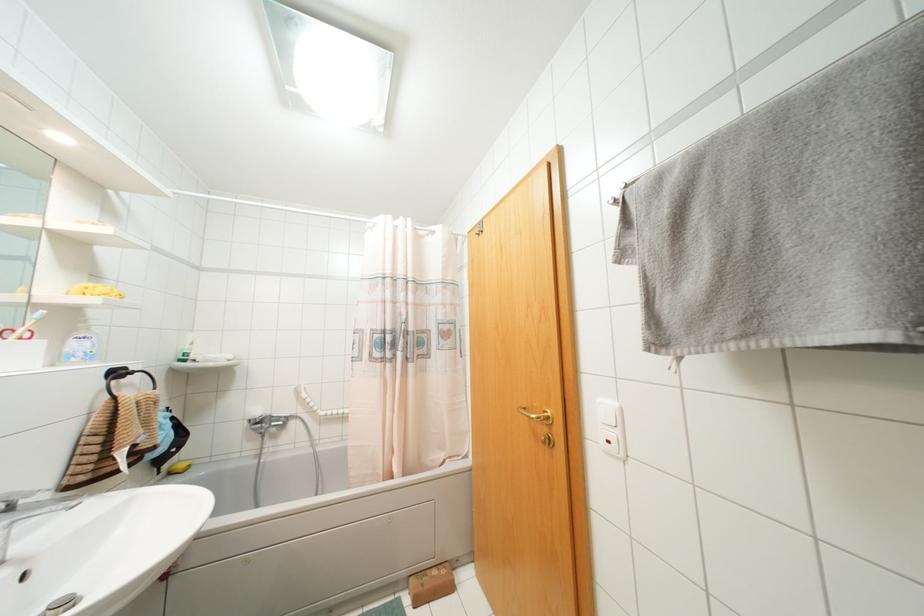
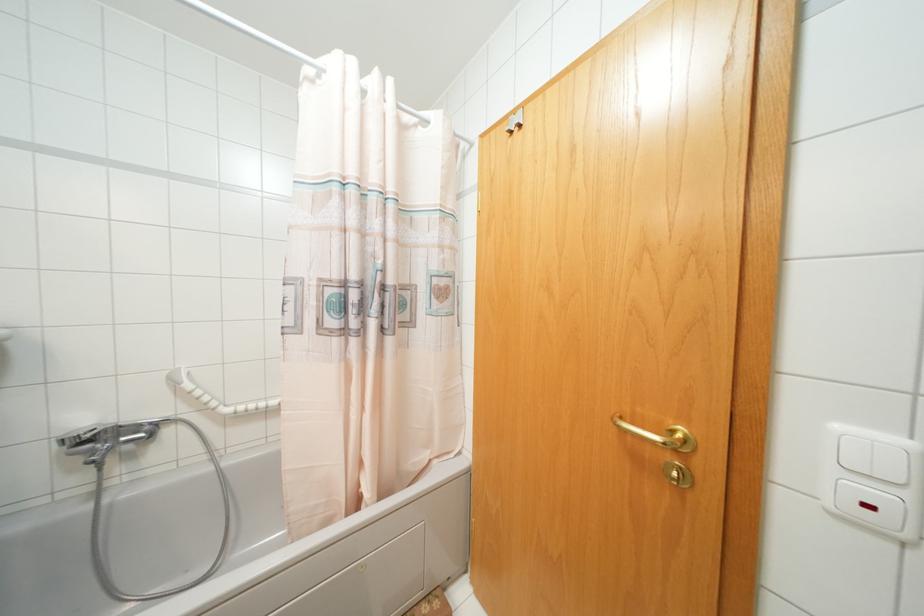
Question: Based on the continuous images, in which direction is the camera rotating? Reply with the corresponding letter.

Choices:
 (A) Left
 (B) Right
 (C) Up
 (D) Down

Answer: (B)